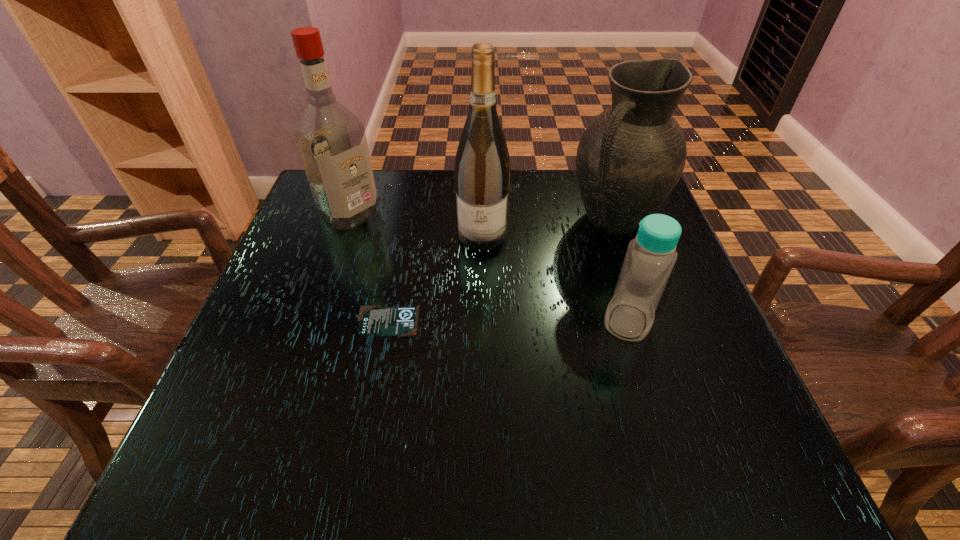
This screenshot has width=960, height=540. I want to click on free spot between the shortest object and the liquor, so click(x=370, y=267).

Locate an element on the screen. The height and width of the screenshot is (540, 960). unoccupied area between the third shortest object and the shortest object is located at coordinates (501, 270).

Identify the location of free space between the bottle and the identity card. This screenshot has height=540, width=960. (508, 321).

This screenshot has width=960, height=540. Find the location of `free point between the second shortest object and the leftmost object`. free point between the second shortest object and the leftmost object is located at coordinates (489, 267).

Find the location of a particular element. This screenshot has width=960, height=540. empty space between the wine bottle and the shortest object is located at coordinates (436, 278).

Where is `free space between the wine bottle and the pitcher`? This screenshot has height=540, width=960. free space between the wine bottle and the pitcher is located at coordinates (548, 227).

Find the location of a particular element. The width and height of the screenshot is (960, 540). free spot between the bottle and the wine bottle is located at coordinates (555, 278).

Identify the location of empty location between the shortest object and the third object from right to left. (436, 278).

Where is `free space between the leftmost object and the bottle`? free space between the leftmost object and the bottle is located at coordinates (489, 267).

Find the location of a particular element. object identified as the third closest to the leftmost object is located at coordinates (631, 156).